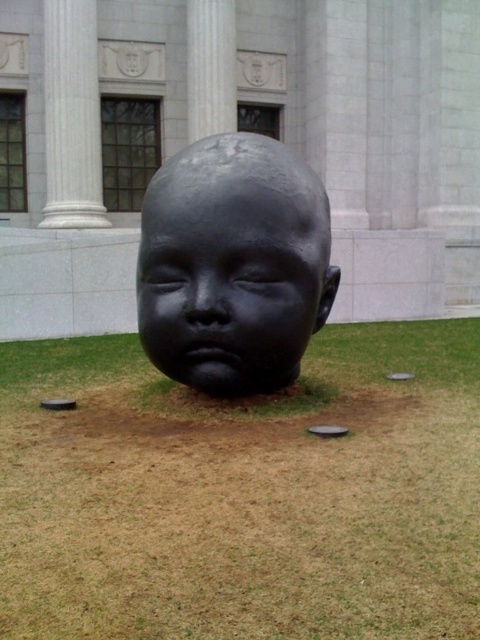
Is black polished stone head at center positioned at the back of black matte sculpture at center?

Yes, it is.

Can you confirm if black polished stone head at center is positioned to the left of black matte sculpture at center?

In fact, black polished stone head at center is to the right of black matte sculpture at center.

Who is more distant from viewer, (x=201, y=259) or (x=205, y=253)?

The point (x=201, y=259) is behind.

Find the location of a particular element. This screenshot has height=640, width=480. black polished stone head at center is located at coordinates (232, 266).

Does white marble column at upper left lie in front of white marble pillar at center?

Yes, it is.

Is white marble column at upper left wider than white marble pillar at center?

Yes, white marble column at upper left is wider than white marble pillar at center.

Which is behind, point (54, 182) or point (232, 104)?

Positioned behind is point (232, 104).

Locate an element on the screen. white marble column at upper left is located at coordinates (72, 116).

Is black polished stone head at center wider than white marble column at upper left?

Correct, the width of black polished stone head at center exceeds that of white marble column at upper left.

Describe the element at coordinates (232, 266) in the screenshot. I see `black polished stone head at center` at that location.

Identify the location of black polished stone head at center. The image size is (480, 640). (232, 266).